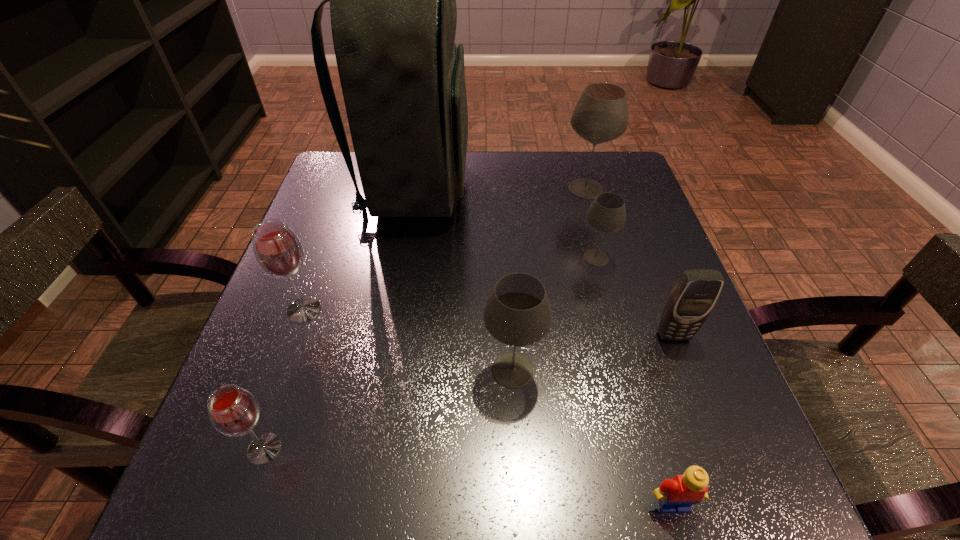
Locate an element on the screen. Image resolution: width=960 pixels, height=540 pixels. object situated at the near left corner is located at coordinates coord(233,411).

Where is `object that is positioned at the far right corner`? This screenshot has width=960, height=540. object that is positioned at the far right corner is located at coordinates 601,115.

Locate an element on the screen. The height and width of the screenshot is (540, 960). object situated at the near right corner is located at coordinates (x=674, y=495).

Find the location of a particular element. The height and width of the screenshot is (540, 960). blank space at the far edge of the desktop is located at coordinates (499, 163).

In order to click on free space at the near edge of the desktop in this screenshot , I will do `click(469, 470)`.

Image resolution: width=960 pixels, height=540 pixels. Identify the location of vacant space at the left edge of the desktop. (309, 239).

At what (x,y) coordinates should I click in order to perform the action: click on free point at the right edge. Please return your answer as a coordinate pair (x, y). This screenshot has width=960, height=540. Looking at the image, I should click on (639, 214).

Image resolution: width=960 pixels, height=540 pixels. In order to click on vacant space at the far left corner of the desktop in this screenshot , I will do `click(331, 199)`.

This screenshot has height=540, width=960. Find the location of `vacant region at the near right corner of the desktop`. vacant region at the near right corner of the desktop is located at coordinates (707, 469).

Find the location of `free space between the second nearest object and the fourth farthest object`. free space between the second nearest object and the fourth farthest object is located at coordinates (284, 379).